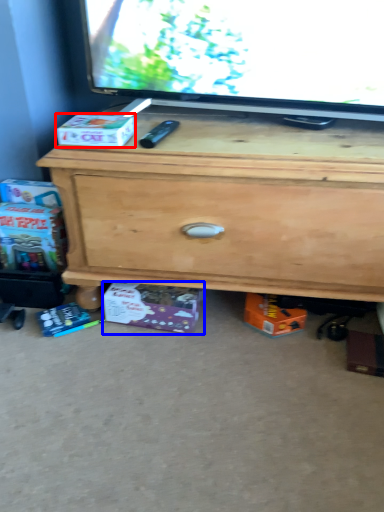
Question: Which point is further to the camera, box (highlighted by a red box) or box (highlighted by a blue box)?

Choices:
 (A) box
 (B) box

Answer: (B)